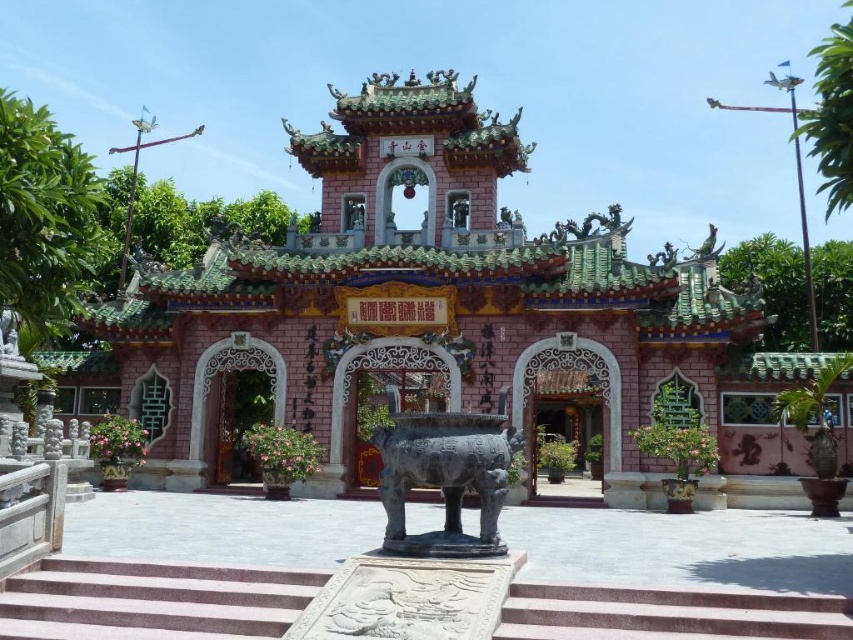
You are a visitor standing at the entrance of the temple. You see the black polished bronze statue at center and the pink stone archway at center. How far apart are these two objects from each other?

The black polished bronze statue at center and the pink stone archway at center are 19.00 meters apart from each other.

Consider the image. You are a visitor standing in front of the temple and want to place a small offering on the black polished bronze statue at center. However, you notice that the statue is smaller than the pink stone archway at center. Based on their sizes, can you determine if the statue is wide enough to place your offering without it falling off?

The black polished bronze statue at center is narrower than the pink stone archway at center. Since the statue is smaller in width, placing the offering might be riskier as it could easily fall off. The pink stone archway at center, being wider, would provide a more stable surface for the offering.